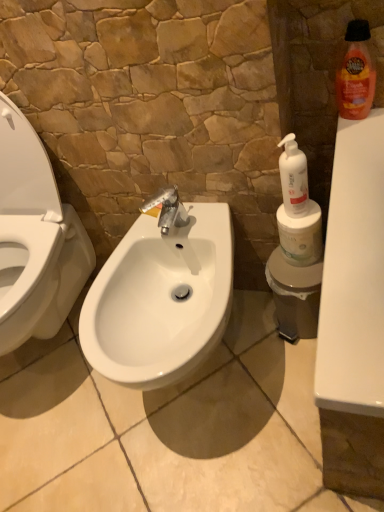
At what (x,y) coordinates should I click in order to perform the action: click on vacant position to the left of white glossy sink at center. Please return your answer as a coordinate pair (x, y). The width and height of the screenshot is (384, 512). Looking at the image, I should click on (78, 449).